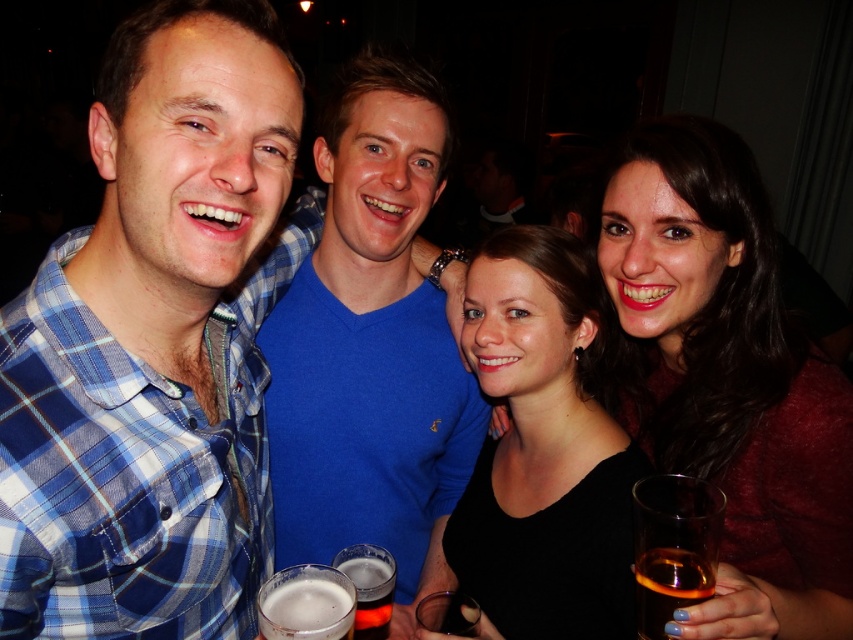
Question: Can you confirm if blue plaid shirt at center is positioned above clear plastic cup at lower center?

Choices:
 (A) no
 (B) yes

Answer: (B)

Question: Can you confirm if blue plaid shirt at center is positioned to the right of blue cotton shirt at center?

Choices:
 (A) yes
 (B) no

Answer: (B)

Question: Which point is closer to the camera?

Choices:
 (A) translucent glass mug at lower center
 (B) blue plaid shirt at center

Answer: (B)

Question: Estimate the real-world distances between objects in this image. Which object is farther from the black matte hair at upper right?

Choices:
 (A) translucent glass mug at lower center
 (B) amber liquid glass at lower right

Answer: (A)

Question: Which object appears farthest from the camera in this image?

Choices:
 (A) black matte hair at upper right
 (B) clear plastic cup at lower center
 (C) amber liquid glass at lower right
 (D) translucent amber glass at lower right

Answer: (B)

Question: Can you confirm if black matte hair at upper right is positioned below clear plastic cup at lower center?

Choices:
 (A) no
 (B) yes

Answer: (A)